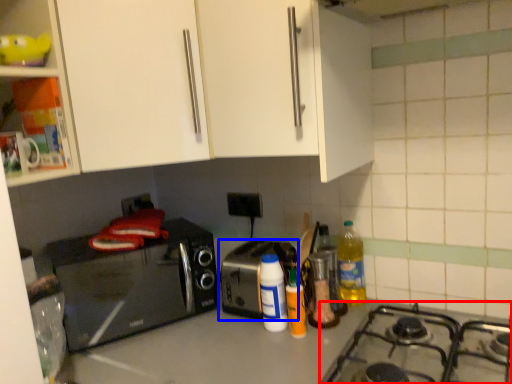
Question: Which point is closer to the camera, gas stove (highlighted by a red box) or toaster (highlighted by a blue box)?

Choices:
 (A) gas stove
 (B) toaster

Answer: (A)